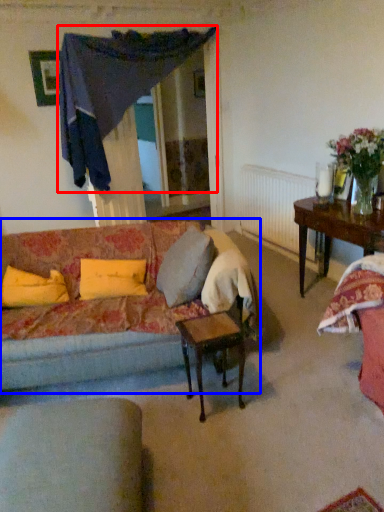
Question: Which object is further to the camera taking this photo, curtain (highlighted by a red box) or studio couch (highlighted by a blue box)?

Choices:
 (A) curtain
 (B) studio couch

Answer: (A)